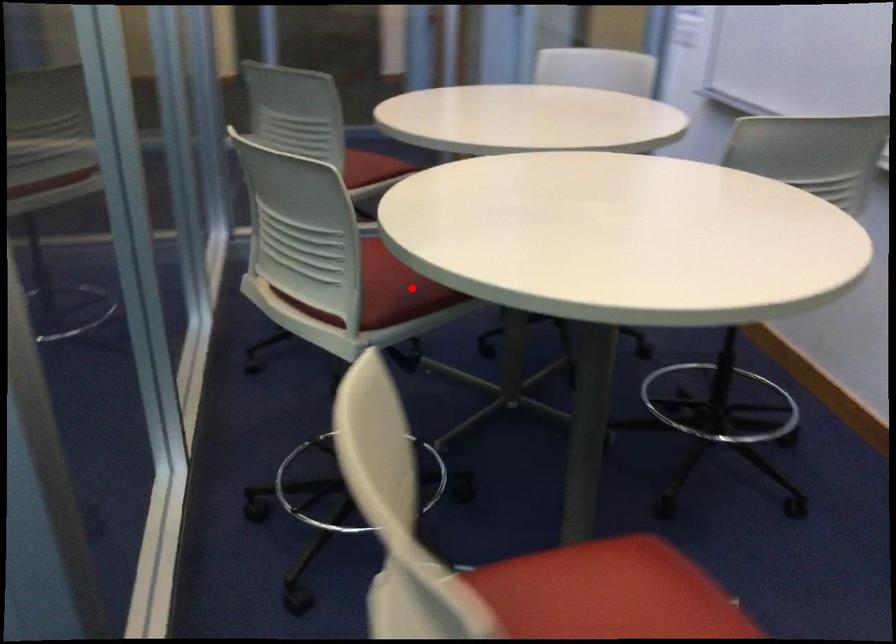
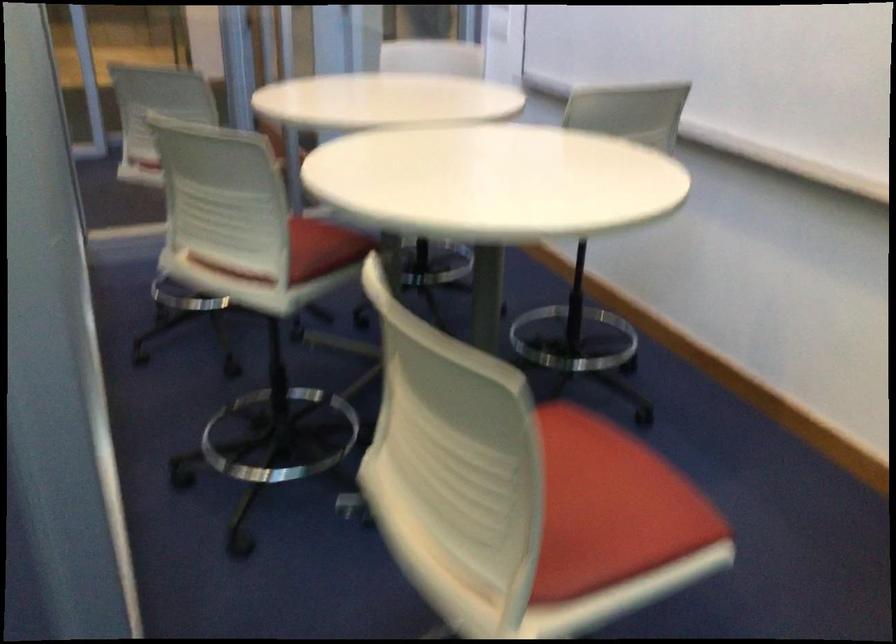
Locate, in the second image, the point that corresponds to the highlighted location in the first image.

(322, 249)